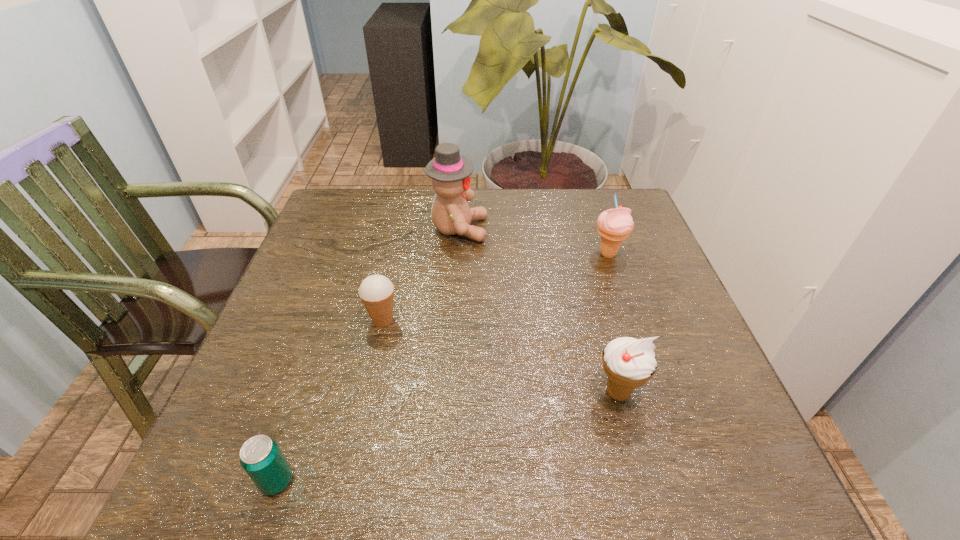
Identify the location of vacant space located 0.100m on the left of the farthest icecream. coord(552,254).

Where is `free region located 0.050m on the right of the leftmost icecream`? free region located 0.050m on the right of the leftmost icecream is located at coordinates (422, 320).

I want to click on blank area located on the back of the nearest object, so click(x=323, y=345).

Find the location of a particular element. object that is positioned at the far edge is located at coordinates (450, 172).

The height and width of the screenshot is (540, 960). What are the coordinates of `object positioned at the near edge` in the screenshot? It's located at (262, 459).

Where is `object positioned at the left edge`? The width and height of the screenshot is (960, 540). object positioned at the left edge is located at coordinates (262, 459).

The height and width of the screenshot is (540, 960). Identify the location of object that is positioned at the near left corner. (262, 459).

You are a GUI agent. You are given a task and a screenshot of the screen. Output one action in this format:
    pyautogui.click(x=<x>, y=<y>)
    Task: Click on the blank space at the far edge
    This screenshot has width=960, height=540.
    Given the screenshot: What is the action you would take?
    pyautogui.click(x=492, y=221)

In the image, there is a desktop. Where is `vacant space at the left edge`? The height and width of the screenshot is (540, 960). vacant space at the left edge is located at coordinates [332, 249].

Image resolution: width=960 pixels, height=540 pixels. In the image, there is a desktop. What are the coordinates of `vacant space at the right edge` in the screenshot? It's located at (656, 352).